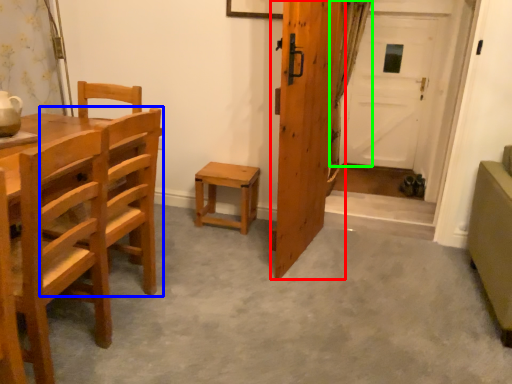
Question: Which object is positioned farthest from door (highlighted by a red box)? Select from chair (highlighted by a blue box) and curtain (highlighted by a green box).

Choices:
 (A) chair
 (B) curtain

Answer: (B)